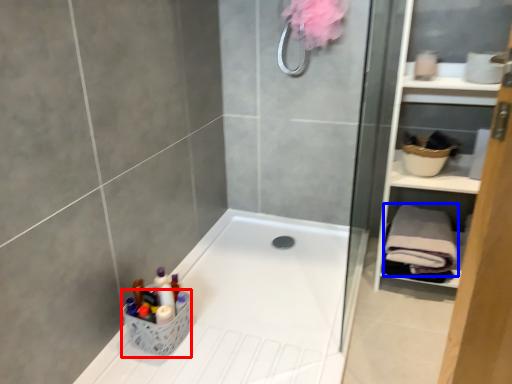
Question: Which point is closer to the camera, basket (highlighted by a red box) or bath towel (highlighted by a blue box)?

Choices:
 (A) basket
 (B) bath towel

Answer: (A)